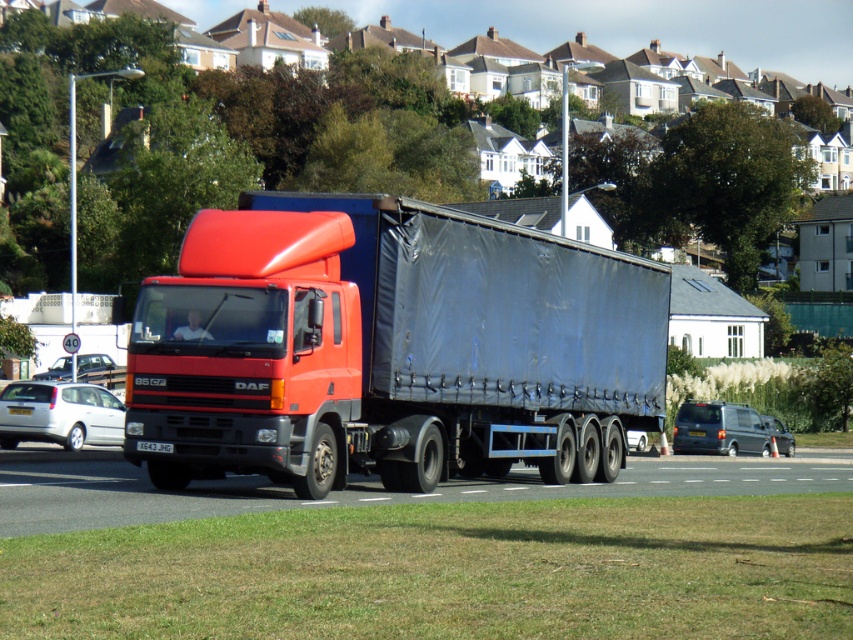
Is silver metallic hatchback at lower left smaller than yellow plastic license plate at center?

No.

Who is taller, silver metallic hatchback at lower left or yellow plastic license plate at center?

silver metallic hatchback at lower left

Where is `silver metallic hatchback at lower left`? silver metallic hatchback at lower left is located at coordinates (61, 413).

Is the position of metallic gray van at center more distant than that of black plastic license plate at center?

Yes, metallic gray van at center is behind black plastic license plate at center.

Between metallic gray van at center and black plastic license plate at center, which one is positioned higher?

black plastic license plate at center

Who is more distant from viewer, (677,426) or (154,442)?

Point (677,426)

Identify the location of metallic gray van at center. The height and width of the screenshot is (640, 853). pyautogui.click(x=727, y=429).

Measure the distance between silver metallic hatchback at lower left and black plastic license plate at center.

14.00 meters

Can you confirm if silver metallic hatchback at lower left is positioned to the right of black plastic license plate at center?

No, silver metallic hatchback at lower left is not to the right of black plastic license plate at center.

Where is `silver metallic hatchback at lower left`? The width and height of the screenshot is (853, 640). silver metallic hatchback at lower left is located at coordinates (61, 413).